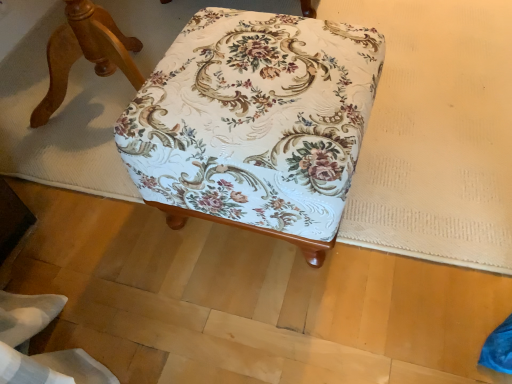
Question: Does point (172, 72) appear closer or farther from the camera than point (124, 64)?

Choices:
 (A) closer
 (B) farther

Answer: (A)

Question: Considering their positions, is floral fabric ottoman at center, which is the 2th furniture in left-to-right order, located in front of or behind floral fabric ottoman at center, the second furniture in the right-to-left sequence?

Choices:
 (A) behind
 (B) front

Answer: (B)

Question: From the image's perspective, is floral fabric ottoman at center, arranged as the first furniture when viewed from the right, located above or below floral fabric ottoman at center, which is counted as the first furniture, starting from the left?

Choices:
 (A) below
 (B) above

Answer: (A)

Question: Does point pos(89,54) appear closer or farther from the camera than point pos(210,56)?

Choices:
 (A) closer
 (B) farther

Answer: (B)

Question: Considering their positions, is floral fabric ottoman at center, the second furniture in the right-to-left sequence, located in front of or behind floral fabric ottoman at center, arranged as the first furniture when viewed from the right?

Choices:
 (A) front
 (B) behind

Answer: (B)

Question: Is floral fabric ottoman at center, the second furniture in the right-to-left sequence, bigger or smaller than floral fabric ottoman at center, which is the 2th furniture in left-to-right order?

Choices:
 (A) big
 (B) small

Answer: (A)

Question: From the image's perspective, is floral fabric ottoman at center, which is counted as the first furniture, starting from the left, above or below floral fabric ottoman at center, which is the 2th furniture in left-to-right order?

Choices:
 (A) above
 (B) below

Answer: (A)